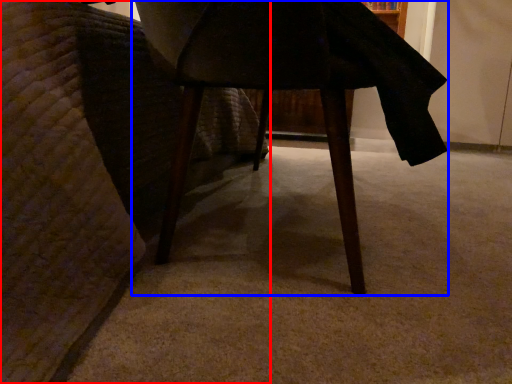
Question: Which point is closer to the camera, furniture (highlighted by a red box) or table (highlighted by a blue box)?

Choices:
 (A) furniture
 (B) table

Answer: (A)